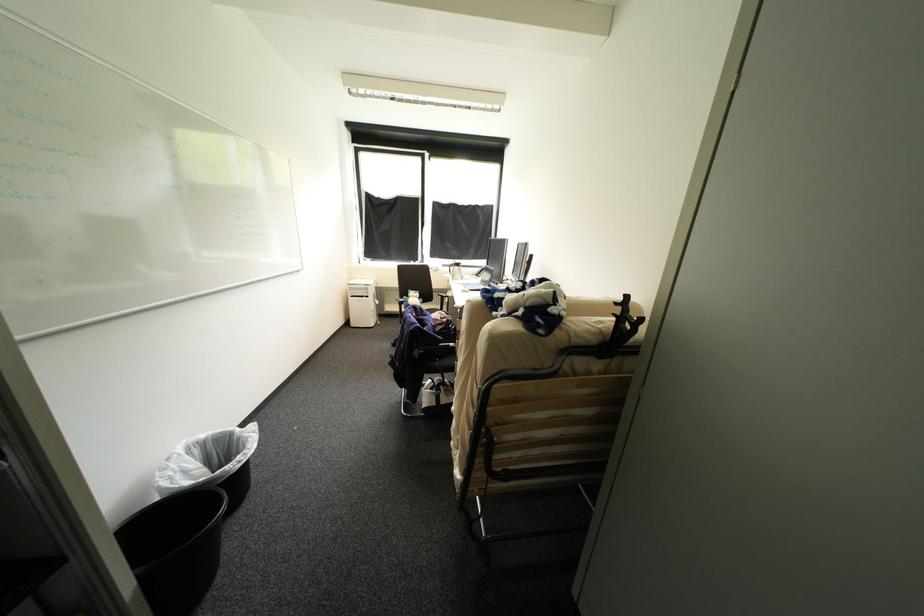
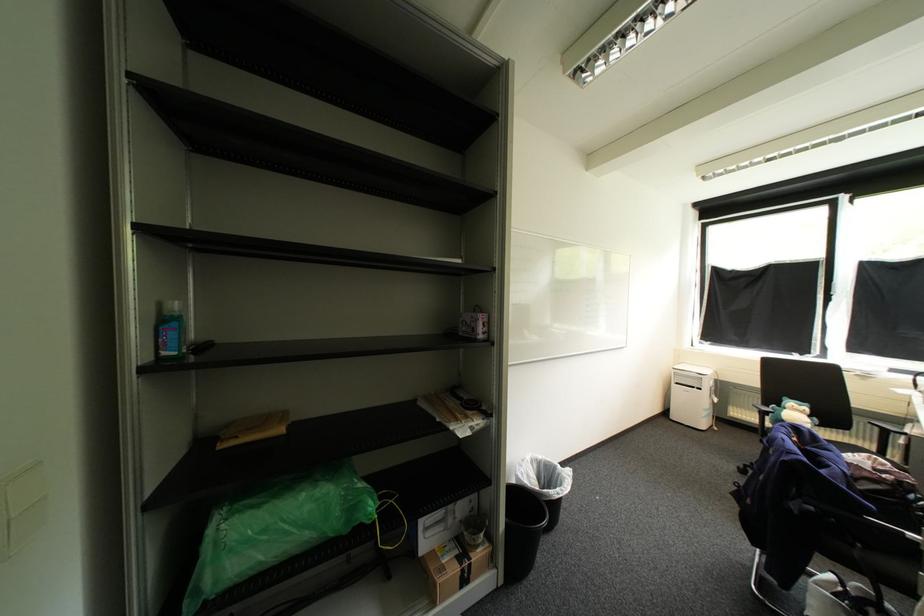
Find the pixel in the second image that matches (416,298) in the first image.

(792, 408)